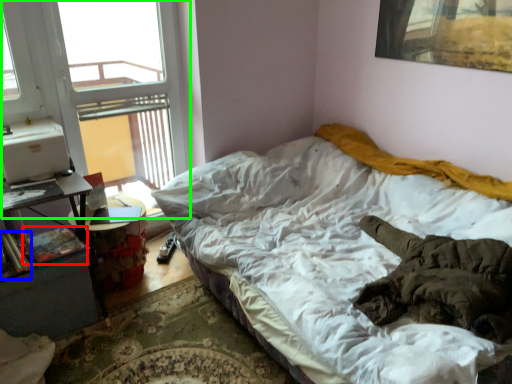
Question: Considering the real-world distances, which object is farthest from book (highlighted by a red box)? book (highlighted by a blue box) or window (highlighted by a green box)?

Choices:
 (A) book
 (B) window

Answer: (B)